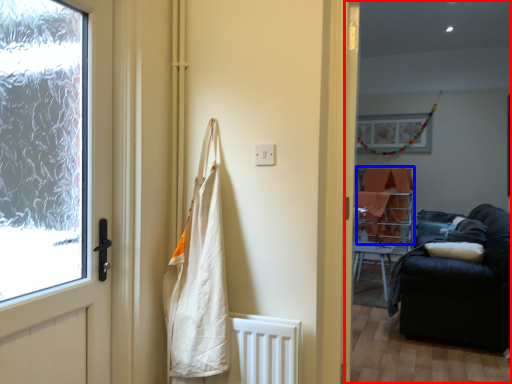
Question: Which point is further to the camera, corridor (highlighted by a red box) or blanket (highlighted by a blue box)?

Choices:
 (A) corridor
 (B) blanket

Answer: (B)